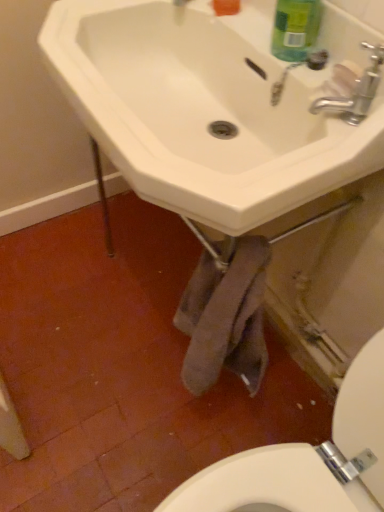
Question: In terms of height, does white ceramic sink at center look taller or shorter compared to silver metallic faucet at upper right?

Choices:
 (A) short
 (B) tall

Answer: (B)

Question: Does point (178, 139) appear closer or farther from the camera than point (370, 95)?

Choices:
 (A) closer
 (B) farther

Answer: (B)

Question: Which object is the closest to the white ceramic sink at center?

Choices:
 (A) green matte bottle at upper right
 (B) silver metallic faucet at upper right

Answer: (A)

Question: Which object is positioned closest to the silver metallic faucet at upper right?

Choices:
 (A) white ceramic sink at center
 (B) green matte bottle at upper right

Answer: (B)